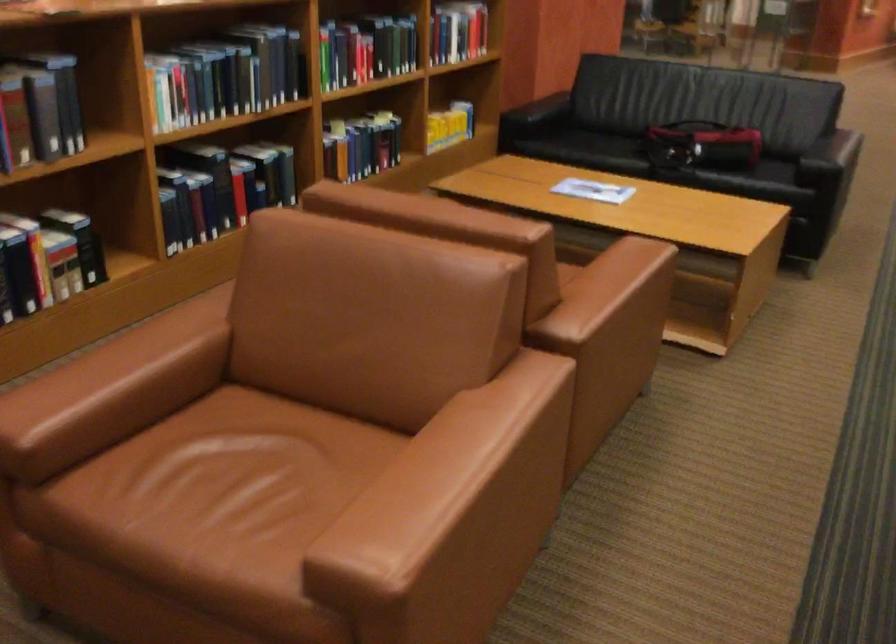
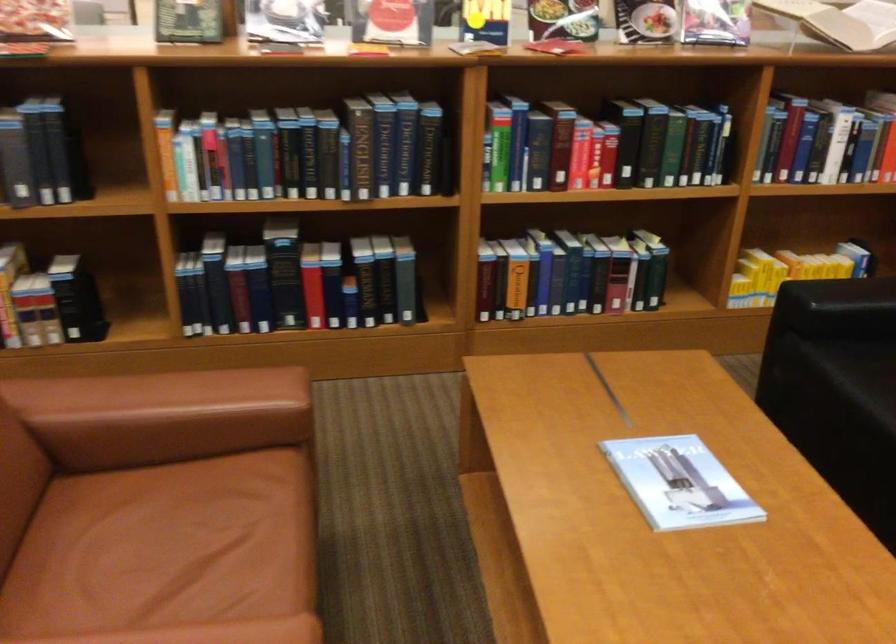
Locate, in the second image, the point that corresponds to (x=366, y=146) in the first image.

(569, 275)